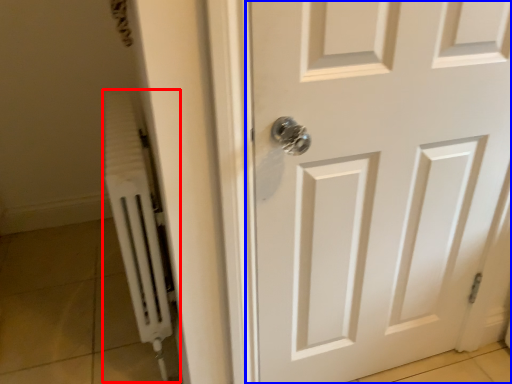
Question: Which of the following is the farthest to the observer, radiator (highlighted by a red box) or door (highlighted by a blue box)?

Choices:
 (A) radiator
 (B) door

Answer: (A)